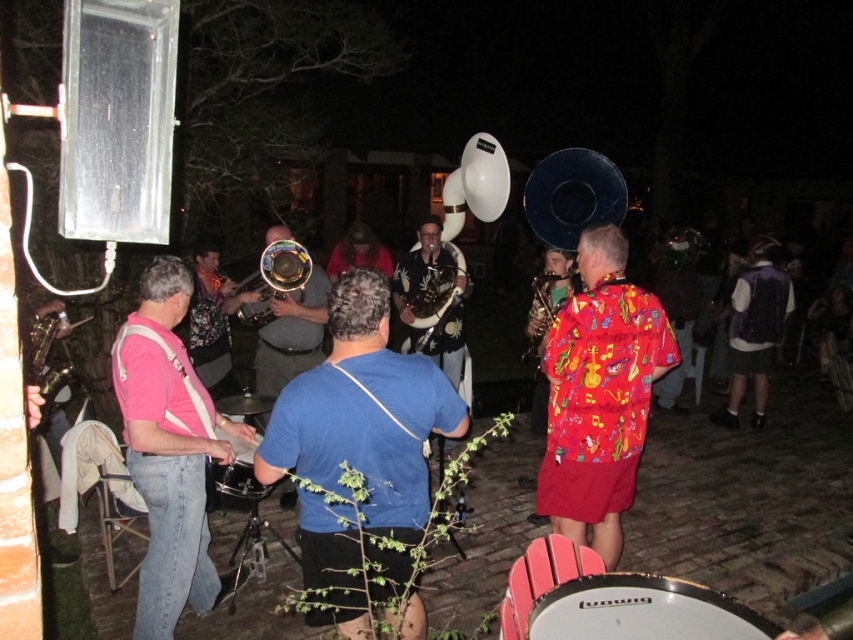
Consider the image. You are a photographer trying to capture the band performance. You notice the blue cotton shirt at center and the black drum at center. Which object should you focus on first if you want to photograph the taller one?

The blue cotton shirt at center is taller than the black drum at center, so you should focus on the blue cotton shirt at center first.